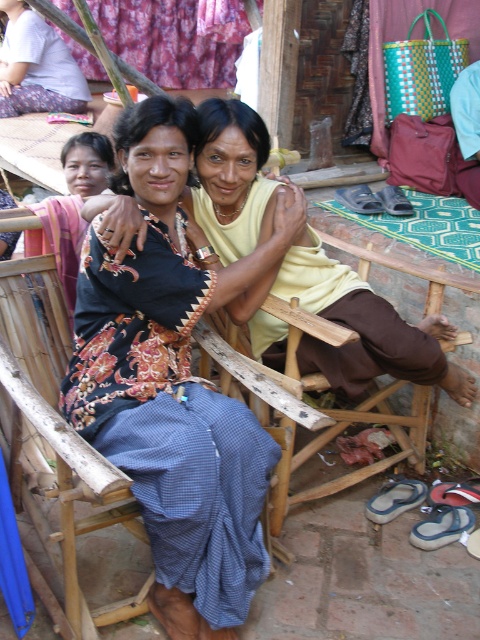
Question: Does printed cotton shirt at center have a lesser width compared to white cotton shirt at upper left?

Choices:
 (A) yes
 (B) no

Answer: (A)

Question: Which point is closer to the camera?

Choices:
 (A) bamboo chair at left
 (B) white cotton shirt at upper left
 (C) wooden chair at center

Answer: (A)

Question: From the image, what is the correct spatial relationship of bamboo chair at left in relation to wooden chair at center?

Choices:
 (A) below
 (B) above

Answer: (B)

Question: Among these points, which one is farthest from the camera?

Choices:
 (A) (99, 572)
 (B) (31, 12)
 (C) (313, 385)

Answer: (B)

Question: In this image, where is printed cotton shirt at center located relative to bamboo chair at left?

Choices:
 (A) left
 (B) right

Answer: (B)

Question: Which point is closer to the camera taking this photo?

Choices:
 (A) (27, 378)
 (B) (149, 100)
 (C) (331, 438)
 (D) (48, 99)

Answer: (B)